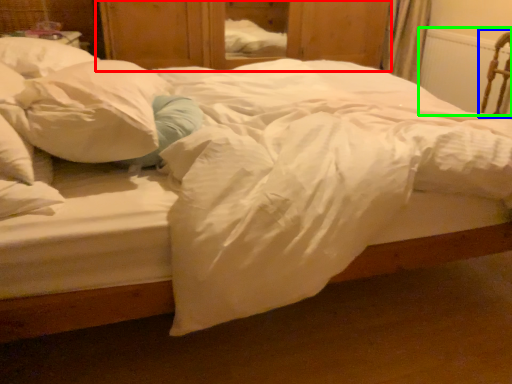
Question: Which is farther away from dresser (highlighted by a red box)? armchair (highlighted by a blue box) or radiator (highlighted by a green box)?

Choices:
 (A) armchair
 (B) radiator

Answer: (A)